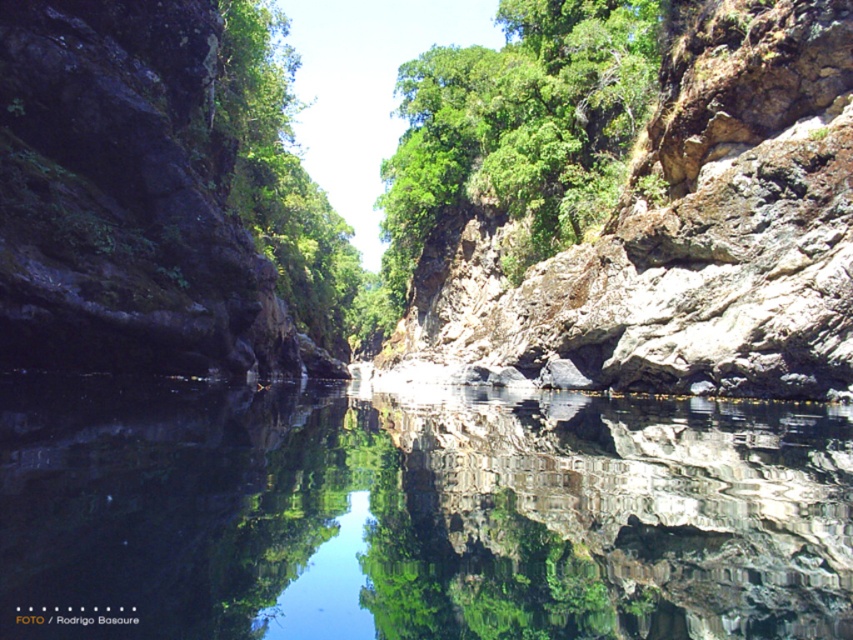
You are a hiker standing at the bottom of the canyon looking up. You notice the rough rock cliff at upper right and the green leafy tree at center. Which object appears taller from your perspective?

The green leafy tree at center is taller than the rough rock cliff at upper right, so it would appear taller from your perspective at the bottom of the canyon.

You are a hiker planning to cross the canyon floor. You notice the rough rock cliff at upper right and the green leafy tree at center. Which object is positioned farther to the right from your perspective?

The rough rock cliff at upper right is farther to the right compared to the green leafy tree at center.